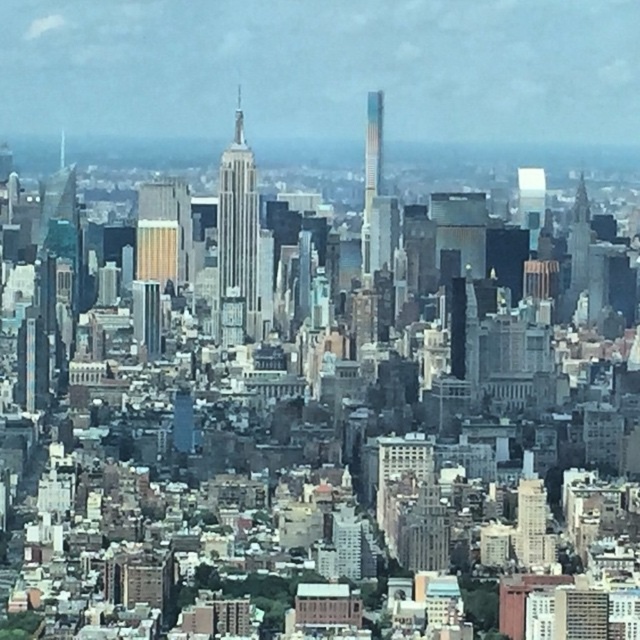
How much distance is there between white glass skyscraper at center and multicolored glass skyscraper at center?

147.84 feet

Can you confirm if white glass skyscraper at center is thinner than multicolored glass skyscraper at center?

No, white glass skyscraper at center is not thinner than multicolored glass skyscraper at center.

Which is in front, point (237, 276) or point (365, 188)?

Point (237, 276) is in front.

What are the coordinates of `white glass skyscraper at center` in the screenshot? It's located at (237, 232).